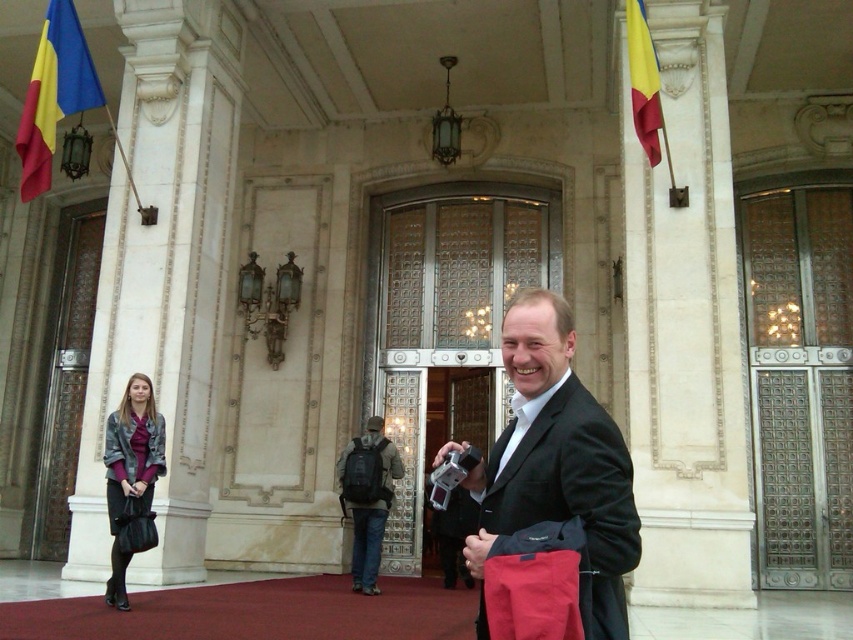
You are a visitor at the entrance of this formal building and need to take a photo of the double doors. You have a dark gray backpack at center and a polyester flag at upper right in your view. Which object is closer to the camera?

The dark gray backpack at center is closer to the camera because it is shorter than the polyester flag at upper right, indicating it occupies a lower position in the frame which typically corresponds to being nearer.

You are a security guard at the entrance of the building. You notice a man wearing a black matte suit at center and a dark gray backpack at center. Based on their positions, which item is closer to the entrance doors?

The black matte suit at center is closer to the entrance doors because it is in front of the dark gray backpack at center, which is further back.